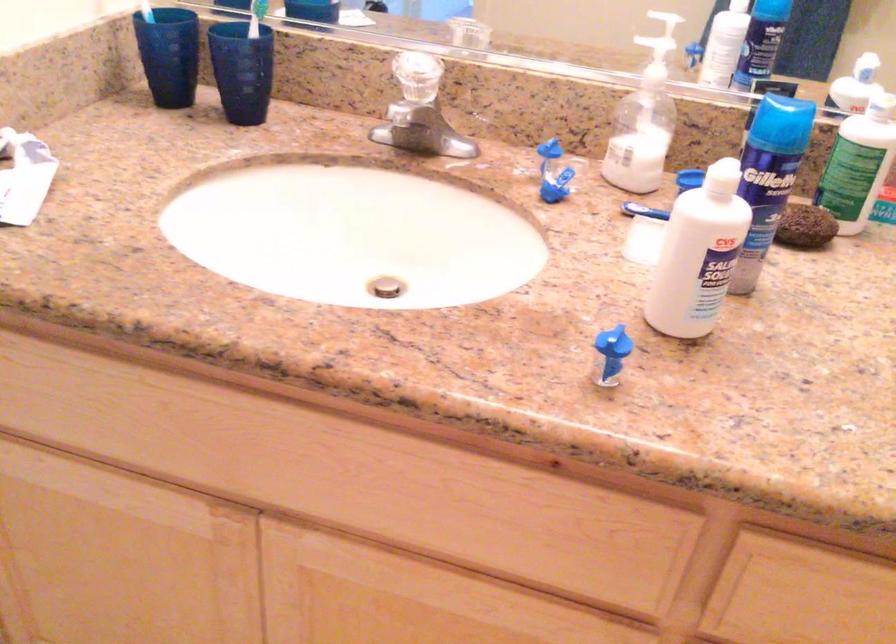
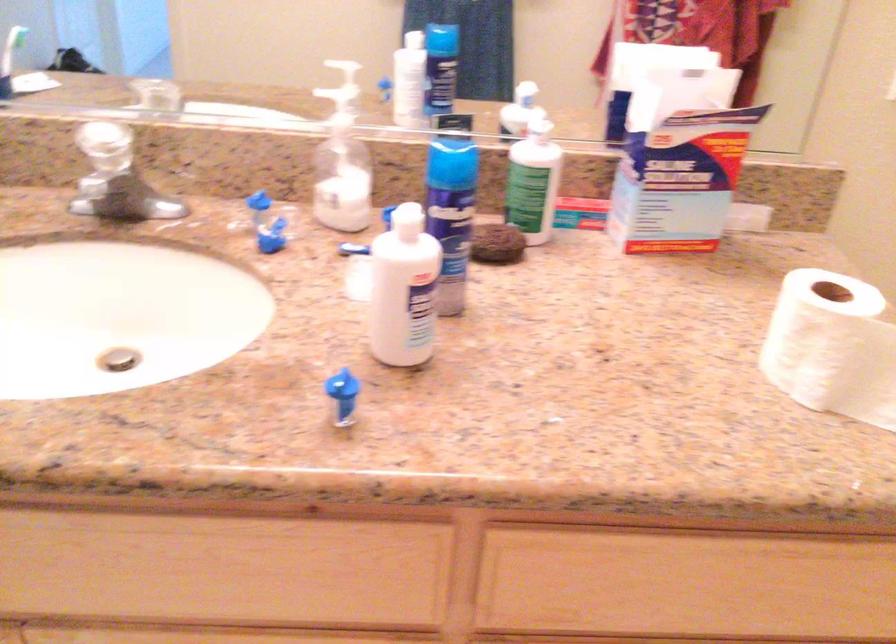
In the second image, find the point that corresponds to the point at 796,228 in the first image.

(496, 243)